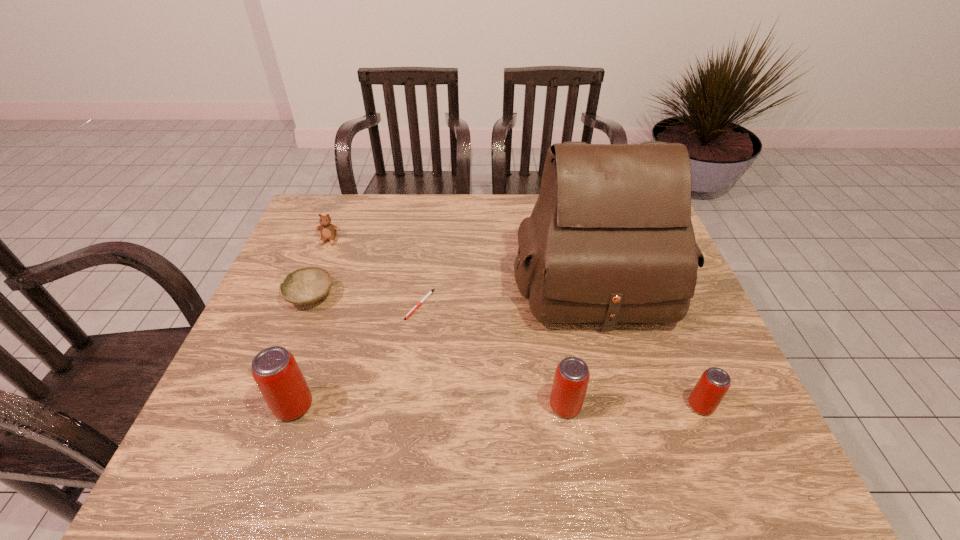
If the aim is uniform spacing by inserting an additional beer_can among them, please point to a vacant space for this new beer_can. Please provide its 2D coordinates. Your answer should be formatted as a tuple, i.e. [(x, y)], where the tuple contains the x and y coordinates of a point satisfying the conditions above.

[(429, 406)]